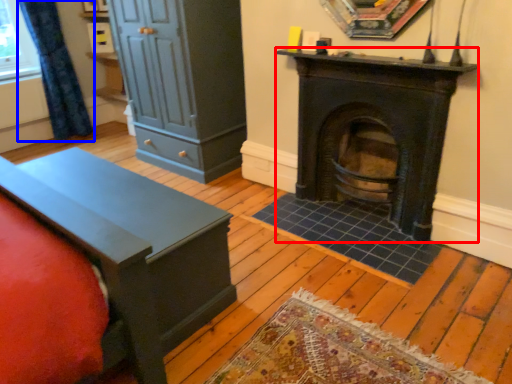
Question: Which point is further to the camera, wood burning stove (highlighted by a red box) or curtain (highlighted by a blue box)?

Choices:
 (A) wood burning stove
 (B) curtain

Answer: (B)